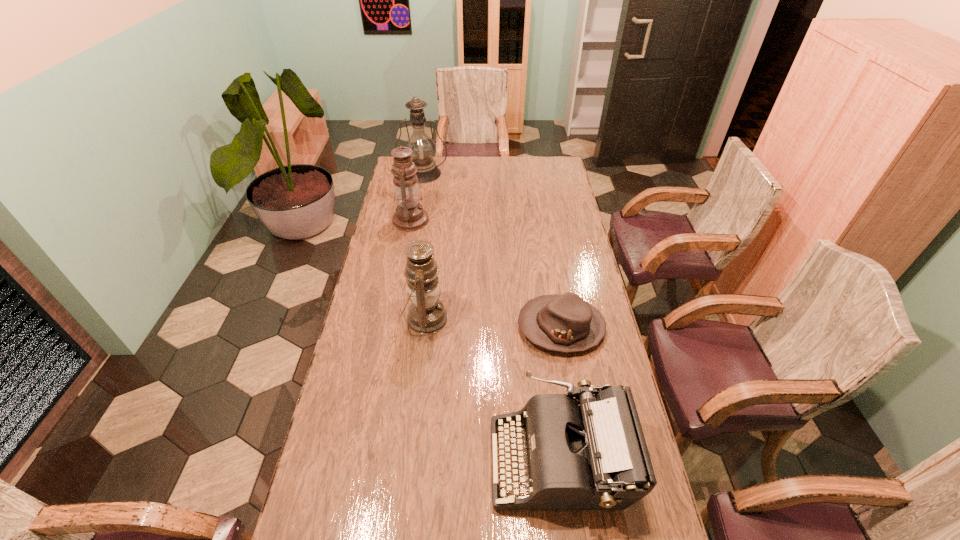
Image resolution: width=960 pixels, height=540 pixels. In order to click on the farthest object in this screenshot , I will do `click(424, 149)`.

You are a GUI agent. You are given a task and a screenshot of the screen. Output one action in this format:
    pyautogui.click(x=<x>, y=<y>)
    Task: Click on the second farthest oil lamp
    
    Given the screenshot: What is the action you would take?
    pyautogui.click(x=410, y=216)

This screenshot has width=960, height=540. In order to click on the nearest oil lamp in this screenshot , I will do `click(427, 315)`.

Find the location of a particular element. typewriter is located at coordinates (589, 452).

The height and width of the screenshot is (540, 960). I want to click on the nearest object, so click(x=589, y=452).

Where is `hat`? This screenshot has height=540, width=960. hat is located at coordinates (566, 323).

Find the location of a particular element. blank area located 0.380m on the right of the farthest oil lamp is located at coordinates (519, 174).

Identify the location of vacant space located 0.190m on the back of the second farthest oil lamp. The height and width of the screenshot is (540, 960). (417, 186).

Identify the location of free space located 0.320m on the right of the nearest oil lamp. (535, 319).

Locate an element on the screen. This screenshot has height=540, width=960. vacant space located on the front-facing side of the typewriter is located at coordinates (378, 460).